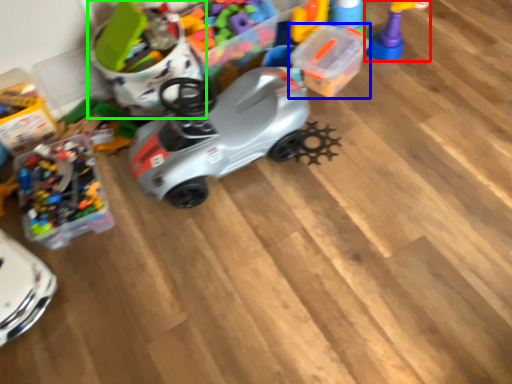
Question: Which is nearer to the toy (highlighted by a red box)? toy (highlighted by a blue box) or toy (highlighted by a green box).

Choices:
 (A) toy
 (B) toy

Answer: (A)